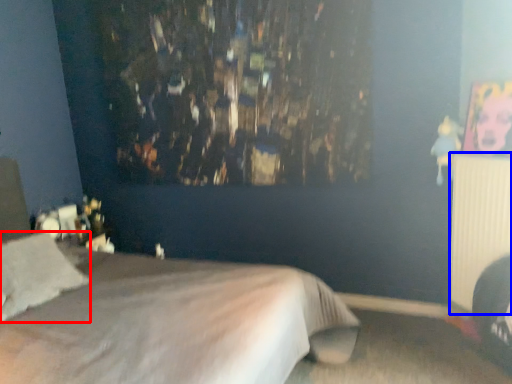
Question: Which of the following is the farthest to the observer, pillow (highlighted by a red box) or radiator (highlighted by a blue box)?

Choices:
 (A) pillow
 (B) radiator

Answer: (B)